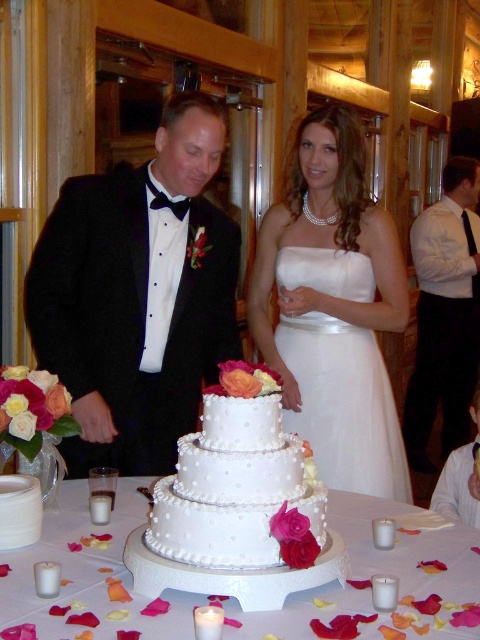
You are a photographer at the wedding and need to capture a closeup shot of the cake. The camera you are using has a maximum focus range of 30 cm. If the distance between you and the white pearlized cake at center is 25 cm, can you focus on the white pearl cake at center?

The white pearlized cake at center is less wide than the white pearl cake at center. However, the focus range is determined by distance, not width. Since the distance to the white pearlized cake at center is 25 cm, which is within the camera maximum focus range of 30 cm, you can focus on the white pearl cake at center.

You are a photographer at the wedding and want to capture a photo of the white satin dress at center and the white shirt at right. Based on their positions, which one is located to the left of the other?

The white satin dress at center is positioned on the left side of white shirt at right.